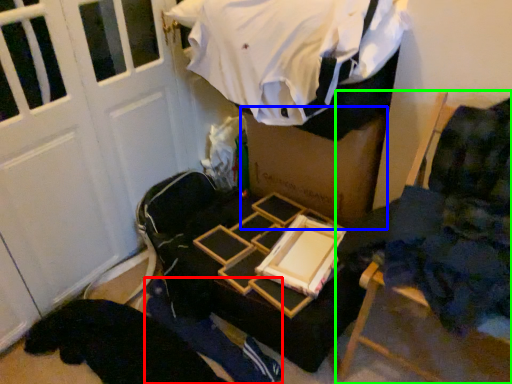
Question: Which object is the closest to the person (highlighted by a red box)? Choose among these: box (highlighted by a blue box) or furniture (highlighted by a green box).

Choices:
 (A) box
 (B) furniture

Answer: (B)